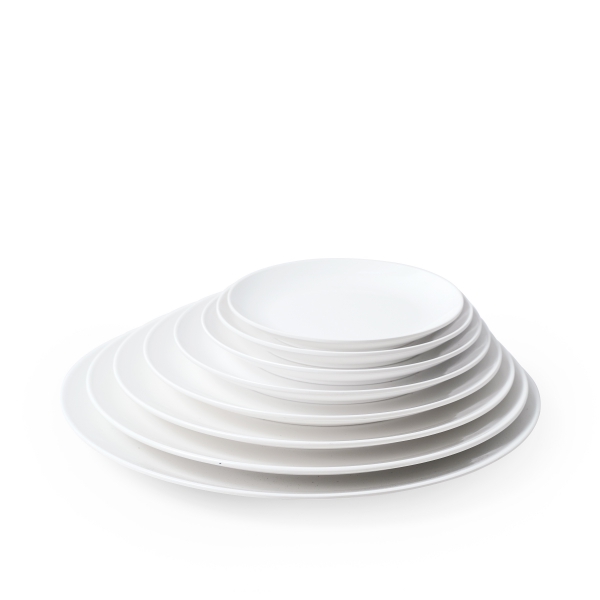
I want to click on plates in a stack, so pos(265,488), pos(270,469), pos(278,446), pos(288,420), pos(302,395), pos(310,375), pos(319,356), pos(321,344).